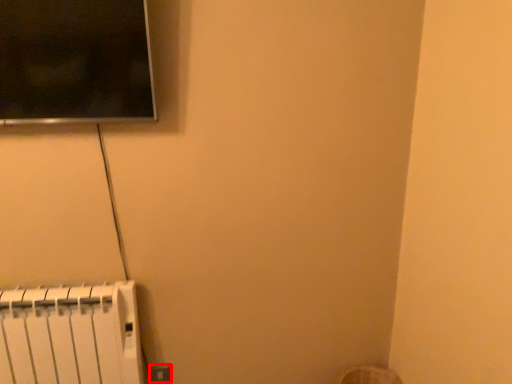
Question: Where is electric outlet (annotated by the red box) located in relation to radiator in the image?

Choices:
 (A) left
 (B) right

Answer: (B)